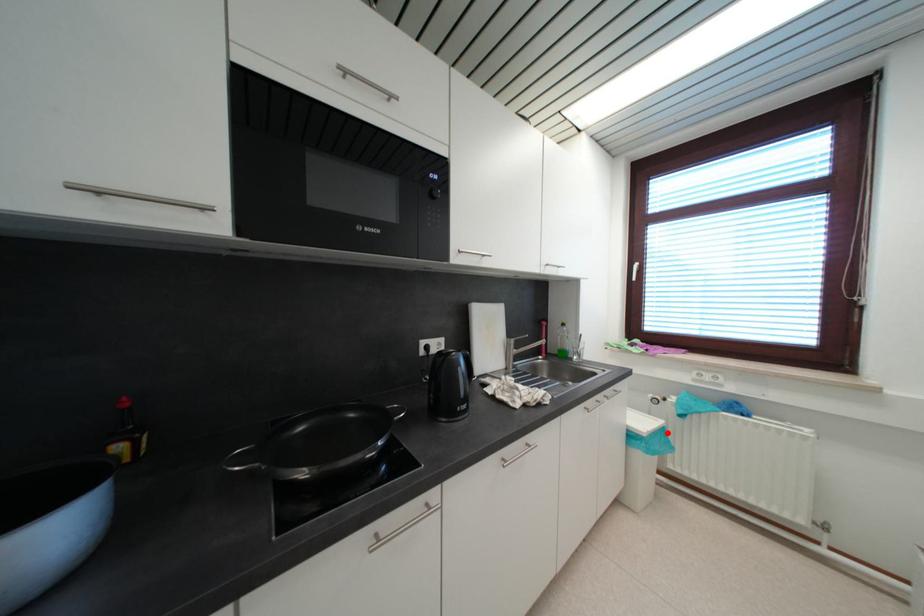
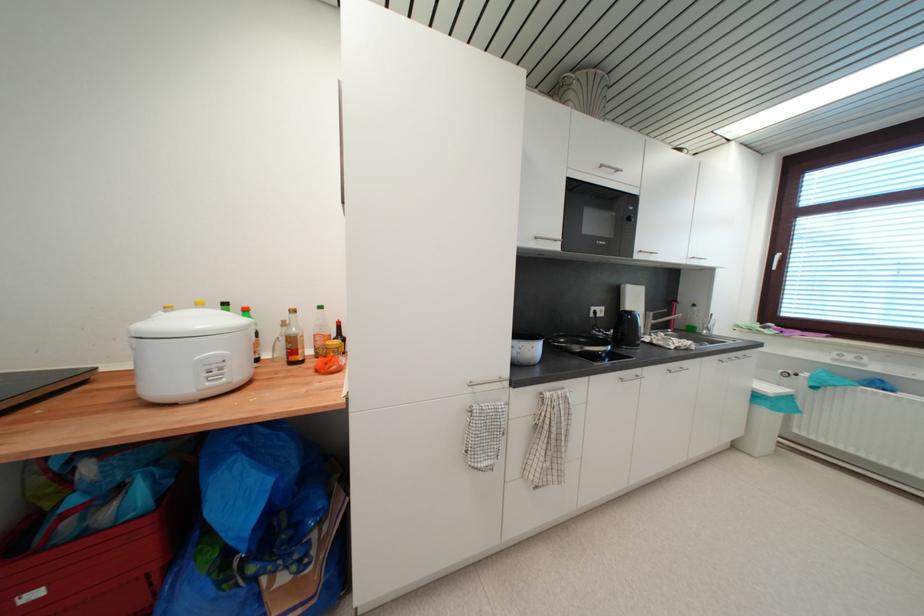
Question: I am providing you with two images of the same scene from different viewpoints. Given a red point in image1, look at the same physical point in image2. Is it:

Choices:
 (A) Closer to the viewpoint
 (B) Farther from the viewpoint

Answer: (A)